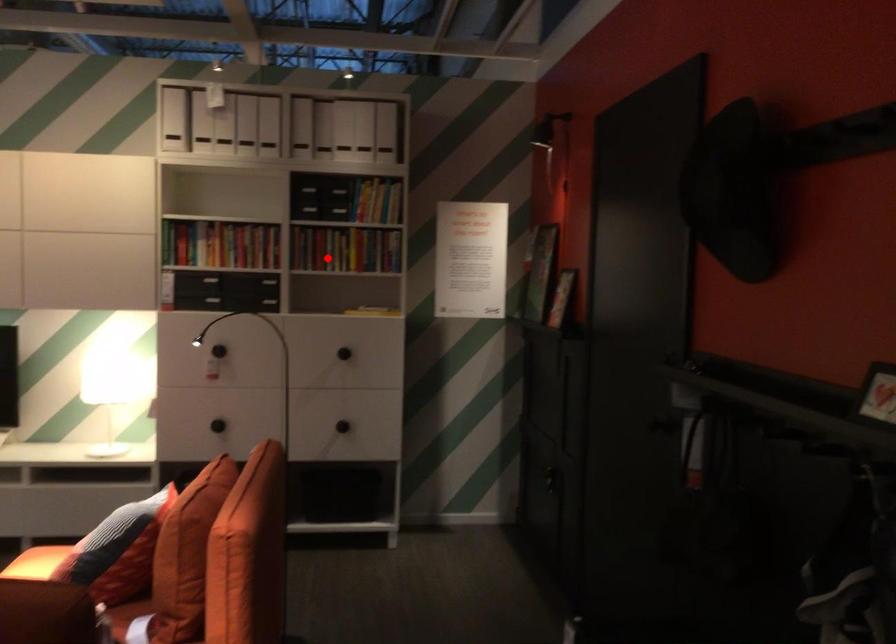
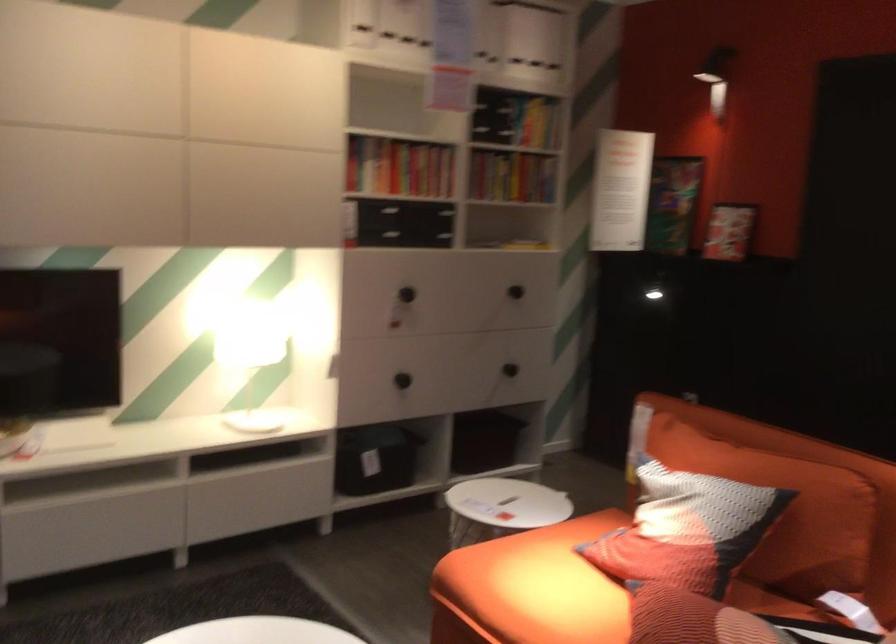
Question: I am providing you with two images of the same scene from different viewpoints. A red point is shown in image1. For the corresponding object point in image2, is it positioned nearer or farther from the camera?

Choices:
 (A) Nearer
 (B) Farther

Answer: (A)